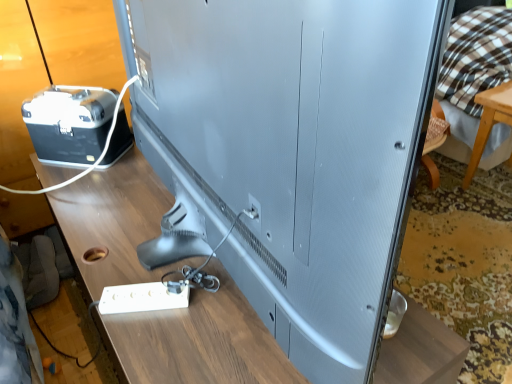
Identify the location of spots to the right of white plastic extension cord at lower left. (215, 315).